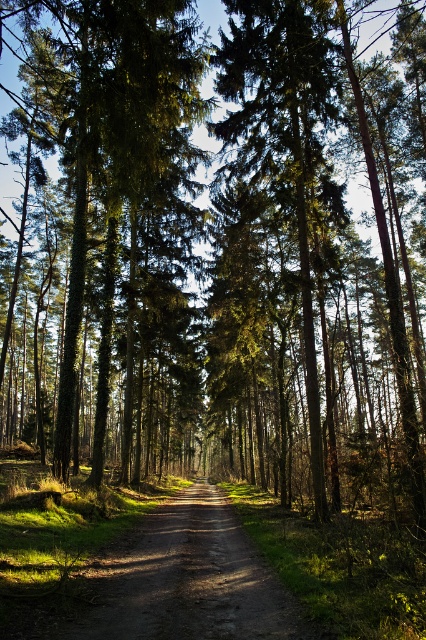
Is point (39, 332) positioned after point (247, 541)?

That is True.

Can you confirm if green textured tree at center is taller than dirt road at center?

Indeed, green textured tree at center has a greater height compared to dirt road at center.

The image size is (426, 640). Describe the element at coordinates (109, 227) in the screenshot. I see `green textured tree at center` at that location.

Locate an element on the screen. Image resolution: width=426 pixels, height=640 pixels. green textured tree at center is located at coordinates (109, 227).